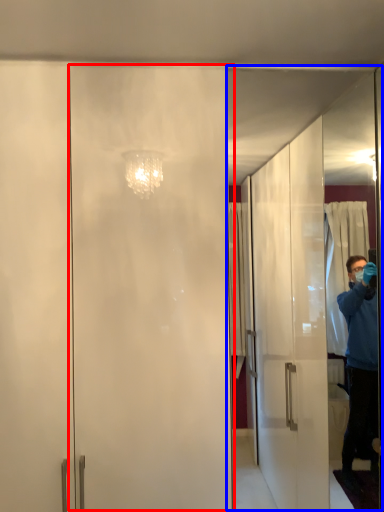
Question: Which object is further to the camera taking this photo, screen door (highlighted by a red box) or screen door (highlighted by a blue box)?

Choices:
 (A) screen door
 (B) screen door

Answer: (B)